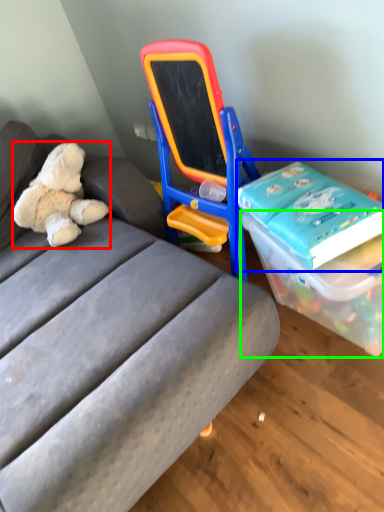
Question: Based on their relative distances, which object is nearer to teddy bear (highlighted by a red box)? Choose from book (highlighted by a blue box) and box (highlighted by a green box).

Choices:
 (A) book
 (B) box

Answer: (A)